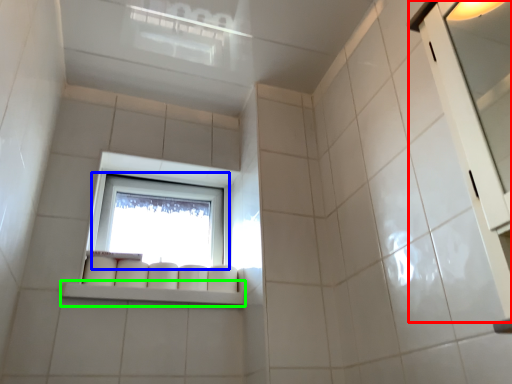
Question: Which object is positioned farthest from screen door (highlighted by a red box)? Select from window (highlighted by a blue box) and window sill (highlighted by a green box).

Choices:
 (A) window
 (B) window sill

Answer: (A)